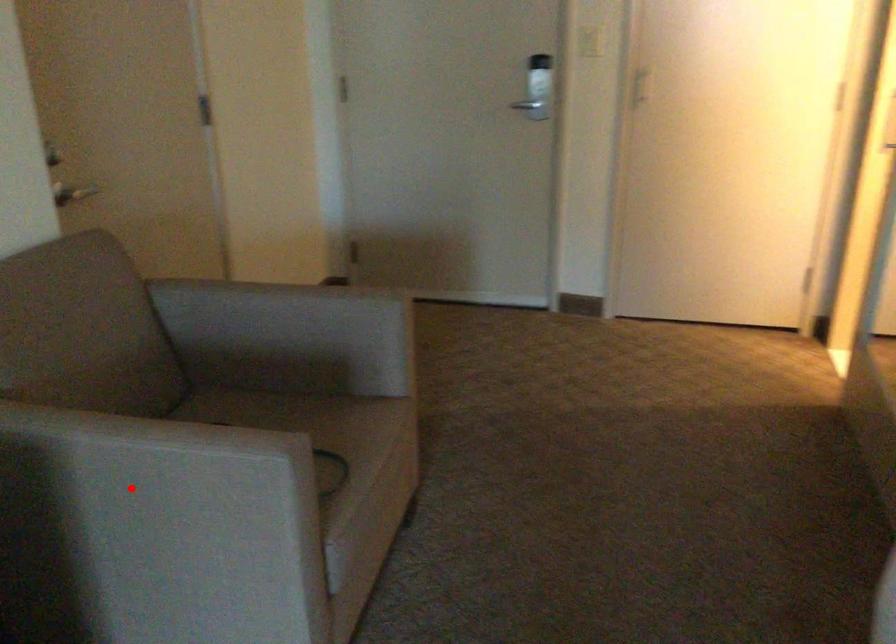
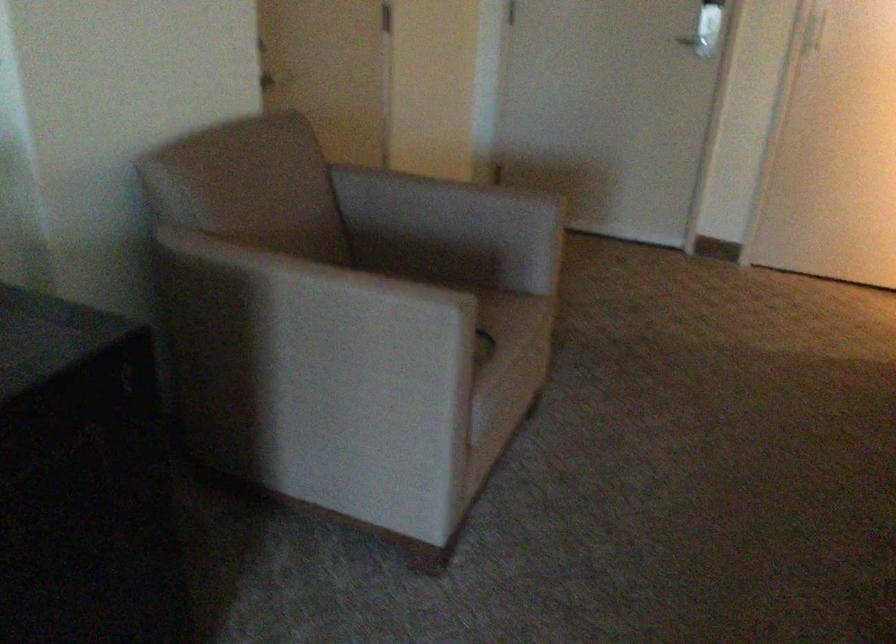
Find the pixel in the second image that matches the highlighted location in the first image.

(314, 325)